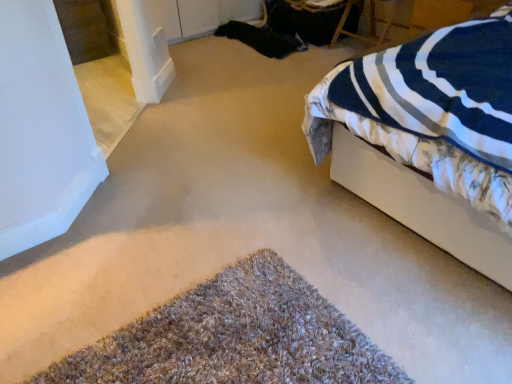
Question: Can you confirm if wooden chair at upper right is taller than white fabric bed at right?

Choices:
 (A) no
 (B) yes

Answer: (A)

Question: Is wooden chair at upper right facing away from white fabric bed at right?

Choices:
 (A) yes
 (B) no

Answer: (B)

Question: Considering the relative sizes of wooden chair at upper right and white fabric bed at right in the image provided, is wooden chair at upper right thinner than white fabric bed at right?

Choices:
 (A) no
 (B) yes

Answer: (B)

Question: From a real-world perspective, is wooden chair at upper right under white fabric bed at right?

Choices:
 (A) no
 (B) yes

Answer: (B)

Question: From a real-world perspective, is wooden chair at upper right located higher than white fabric bed at right?

Choices:
 (A) no
 (B) yes

Answer: (A)

Question: Is wooden chair at upper right shorter than white fabric bed at right?

Choices:
 (A) yes
 (B) no

Answer: (A)

Question: Are white fabric bed at right and brown shaggy carpet at lower center making contact?

Choices:
 (A) no
 (B) yes

Answer: (A)

Question: Is white fabric bed at right far from brown shaggy carpet at lower center?

Choices:
 (A) no
 (B) yes

Answer: (A)

Question: Does white fabric bed at right turn towards brown shaggy carpet at lower center?

Choices:
 (A) no
 (B) yes

Answer: (B)

Question: Does white fabric bed at right have a larger size compared to brown shaggy carpet at lower center?

Choices:
 (A) no
 (B) yes

Answer: (B)

Question: Does white fabric bed at right have a greater height compared to brown shaggy carpet at lower center?

Choices:
 (A) no
 (B) yes

Answer: (B)

Question: From a real-world perspective, is white fabric bed at right located higher than brown shaggy carpet at lower center?

Choices:
 (A) yes
 (B) no

Answer: (A)

Question: Can you confirm if white fabric bed at right is taller than wooden chair at upper right?

Choices:
 (A) yes
 (B) no

Answer: (A)